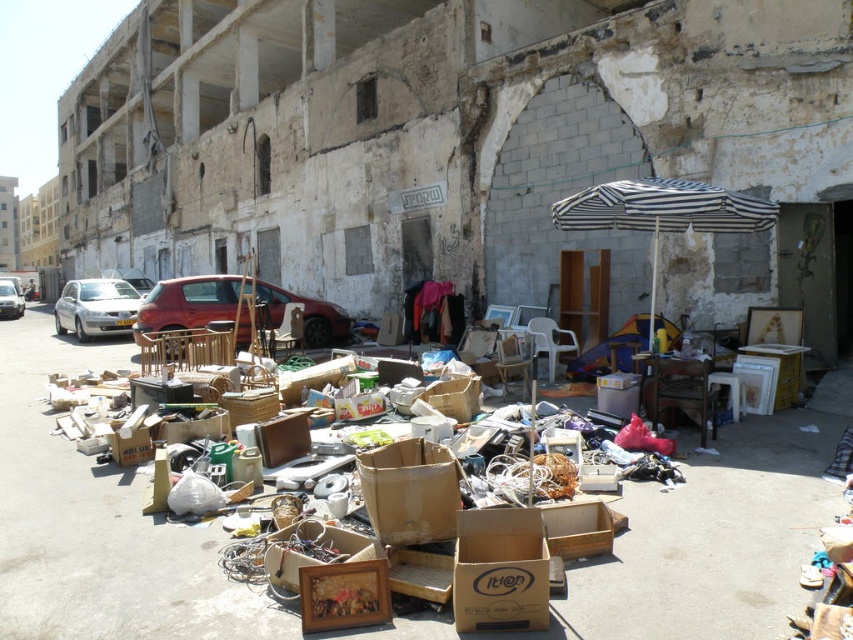
Is cardboard box at center thinner than black and white striped umbrella at center?

Yes.

Does point (526, 604) come farther from viewer compared to point (682, 193)?

No, it is in front of (682, 193).

Where is `cardboard box at center`? The image size is (853, 640). cardboard box at center is located at coordinates (498, 570).

Who is lower down, brown cardboard boxes at center or white matte car at left?

brown cardboard boxes at center is lower down.

Locate an element on the screen. This screenshot has width=853, height=640. brown cardboard boxes at center is located at coordinates (97, 525).

Locate an element on the screen. The image size is (853, 640). brown cardboard boxes at center is located at coordinates (97, 525).

Does brown cardboard box at center have a lesser height compared to metallic red car at center?

Correct, brown cardboard box at center is not as tall as metallic red car at center.

Is point (430, 476) positioned behind point (238, 291)?

That is False.

Who is more forward, (451,465) or (303,337)?

Point (451,465) is more forward.

Image resolution: width=853 pixels, height=640 pixels. Find the location of `brown cardboard box at center`. brown cardboard box at center is located at coordinates (410, 492).